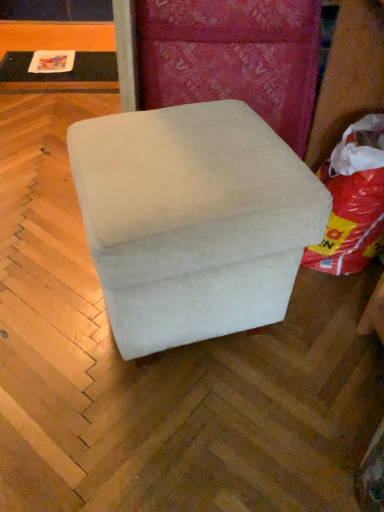
Question: Can you confirm if matte black table at upper left is wider than white fabric bean bag at right?

Choices:
 (A) no
 (B) yes

Answer: (B)

Question: Can you confirm if matte black table at upper left is taller than white fabric bean bag at right?

Choices:
 (A) no
 (B) yes

Answer: (A)

Question: From the image's perspective, is matte black table at upper left over white fabric bean bag at right?

Choices:
 (A) yes
 (B) no

Answer: (A)

Question: Does matte black table at upper left lie in front of white fabric bean bag at right?

Choices:
 (A) no
 (B) yes

Answer: (A)

Question: Does matte black table at upper left come behind white fabric bean bag at right?

Choices:
 (A) yes
 (B) no

Answer: (A)

Question: From a real-world perspective, is matte black table at upper left positioned above or below white fabric bean bag at right?

Choices:
 (A) above
 (B) below

Answer: (B)

Question: Considering the positions of matte black table at upper left and white fabric bean bag at right in the image, is matte black table at upper left wider or thinner than white fabric bean bag at right?

Choices:
 (A) thin
 (B) wide

Answer: (B)

Question: Is point (19, 90) closer or farther from the camera than point (327, 234)?

Choices:
 (A) farther
 (B) closer

Answer: (A)

Question: From the image's perspective, is matte black table at upper left above or below white fabric bean bag at right?

Choices:
 (A) below
 (B) above

Answer: (B)

Question: From their relative heights in the image, would you say white fabric ottoman at center is taller or shorter than white fabric bean bag at right?

Choices:
 (A) short
 (B) tall

Answer: (B)

Question: Looking at their shapes, would you say white fabric ottoman at center is wider or thinner than white fabric bean bag at right?

Choices:
 (A) wide
 (B) thin

Answer: (A)

Question: From a real-world perspective, is white fabric ottoman at center positioned above or below white fabric bean bag at right?

Choices:
 (A) above
 (B) below

Answer: (A)

Question: Which is correct: white fabric ottoman at center is inside white fabric bean bag at right, or outside of it?

Choices:
 (A) outside
 (B) inside

Answer: (A)

Question: From the image's perspective, is white fabric bean bag at right above or below matte black table at upper left?

Choices:
 (A) above
 (B) below

Answer: (B)

Question: Choose the correct answer: Is white fabric bean bag at right inside matte black table at upper left or outside it?

Choices:
 (A) outside
 (B) inside

Answer: (A)